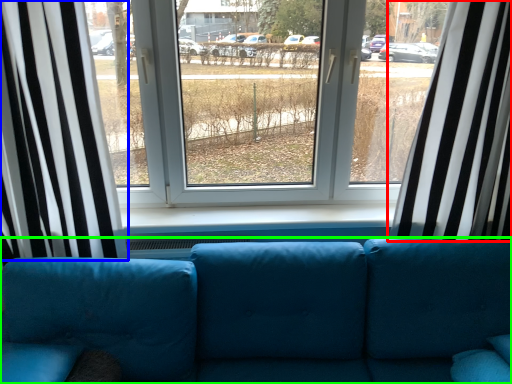
Question: Based on their relative distances, which object is nearer to curtain (highlighted by a red box)? Choose from curtain (highlighted by a blue box) and studio couch (highlighted by a green box).

Choices:
 (A) curtain
 (B) studio couch

Answer: (B)